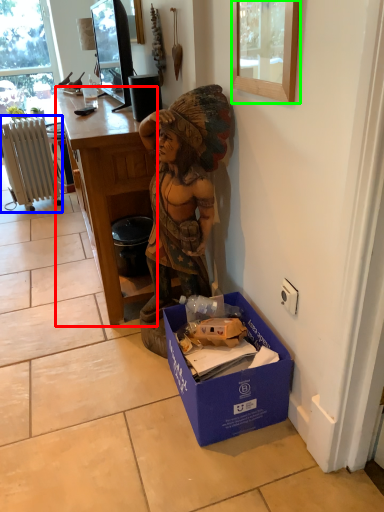
Question: Which object is the closest to the desk (highlighted by a red box)? Choose among these: radiator (highlighted by a blue box) or picture frame (highlighted by a green box).

Choices:
 (A) radiator
 (B) picture frame

Answer: (B)